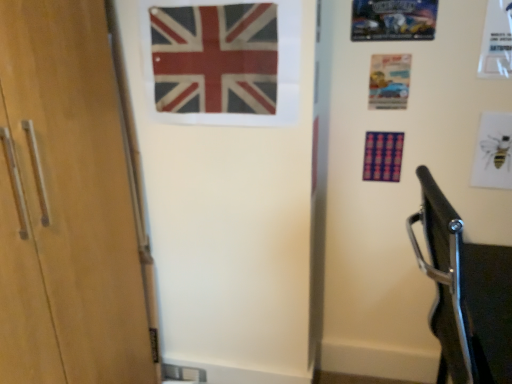
Where is `white paper bee at upper right, acting as the 3th postcard starting from the left`? This screenshot has width=512, height=384. white paper bee at upper right, acting as the 3th postcard starting from the left is located at coordinates (493, 152).

The width and height of the screenshot is (512, 384). What do you see at coordinates (389, 81) in the screenshot?
I see `matte paper postcard at upper right, acting as the second postcard starting from the top` at bounding box center [389, 81].

Find the location of `red and white fabric flag at upper center`. red and white fabric flag at upper center is located at coordinates (215, 58).

Locate an element on the screen. The height and width of the screenshot is (384, 512). white paper bee at upper right, the third postcard viewed from the top is located at coordinates (493, 152).

Is metallic silver car at upper right, the 1th postcard in the top-to-bottom sequence, taller than matte paper postcard at upper right, which ranks as the second postcard in bottom-to-top order?

No, metallic silver car at upper right, the 1th postcard in the top-to-bottom sequence, is not taller than matte paper postcard at upper right, which ranks as the second postcard in bottom-to-top order.

Is matte paper postcard at upper right, which ranks as the second postcard in bottom-to-top order, located within metallic silver car at upper right, which is counted as the third postcard, starting from the bottom?

No, metallic silver car at upper right, which is counted as the third postcard, starting from the bottom, does not contain matte paper postcard at upper right, which ranks as the second postcard in bottom-to-top order.

Considering the positions of points (401, 8) and (403, 70), is point (401, 8) farther from camera compared to point (403, 70)?

That is False.

How much distance is there between red and white fabric flag at upper center and white paper bee at upper right, positioned as the first postcard in bottom-to-top order?

red and white fabric flag at upper center is 1.00 meters from white paper bee at upper right, positioned as the first postcard in bottom-to-top order.

Is red and white fabric flag at upper center positioned with its back to white paper bee at upper right, the third postcard viewed from the top?

No, white paper bee at upper right, the third postcard viewed from the top, is not at the back of red and white fabric flag at upper center.

Based on the photo, considering the positions of objects red and white fabric flag at upper center and white paper bee at upper right, acting as the 3th postcard starting from the left, in the image provided, who is more to the right, red and white fabric flag at upper center or white paper bee at upper right, acting as the 3th postcard starting from the left,?

From the viewer's perspective, white paper bee at upper right, acting as the 3th postcard starting from the left, appears more on the right side.

Is red and white fabric flag at upper center bigger than metallic silver car at upper right, acting as the first postcard starting from the left?

Indeed, red and white fabric flag at upper center has a larger size compared to metallic silver car at upper right, acting as the first postcard starting from the left.

Between point (173, 45) and point (386, 14), which one is positioned in front?

Point (173, 45)

Is red and white fabric flag at upper center with metallic silver car at upper right, which is the 3th postcard from right to left?

There is a gap between red and white fabric flag at upper center and metallic silver car at upper right, which is the 3th postcard from right to left.

Is matte paper postcard at upper right, the 2th postcard in the left-to-right sequence, further to camera compared to metallic silver car at upper right, which is the 3th postcard from right to left?

Yes, it is.

Looking at their sizes, would you say matte paper postcard at upper right, which appears as the second postcard when viewed from the right, is wider or thinner than metallic silver car at upper right, acting as the first postcard starting from the left?

Clearly, matte paper postcard at upper right, which appears as the second postcard when viewed from the right, has less width compared to metallic silver car at upper right, acting as the first postcard starting from the left.

Is the surface of matte paper postcard at upper right, which appears as the second postcard when viewed from the right, in direct contact with metallic silver car at upper right, acting as the first postcard starting from the left?

They are not placed beside each other.

Can you confirm if matte paper postcard at upper right, acting as the second postcard starting from the top, is shorter than metallic silver car at upper right, which is counted as the third postcard, starting from the bottom?

No, matte paper postcard at upper right, acting as the second postcard starting from the top, is not shorter than metallic silver car at upper right, which is counted as the third postcard, starting from the bottom.

From the image's perspective, who appears lower, matte paper postcard at upper right, which ranks as the second postcard in bottom-to-top order, or white paper bee at upper right, positioned as the first postcard in bottom-to-top order?

white paper bee at upper right, positioned as the first postcard in bottom-to-top order, appears lower in the image.

Consider the image. Is matte paper postcard at upper right, which appears as the second postcard when viewed from the right, not within white paper bee at upper right, acting as the 3th postcard starting from the left?

matte paper postcard at upper right, which appears as the second postcard when viewed from the right, lies outside white paper bee at upper right, acting as the 3th postcard starting from the left,'s area.

How many degrees apart are the facing directions of matte paper postcard at upper right, which ranks as the second postcard in bottom-to-top order, and white paper bee at upper right, acting as the 3th postcard starting from the left?

matte paper postcard at upper right, which ranks as the second postcard in bottom-to-top order, and white paper bee at upper right, acting as the 3th postcard starting from the left, are facing 0.113 degrees away from each other.

Which object is positioned more to the left, matte paper postcard at upper right, acting as the second postcard starting from the top, or white paper bee at upper right, positioned as the first postcard in bottom-to-top order?

matte paper postcard at upper right, acting as the second postcard starting from the top, is more to the left.

Is white paper bee at upper right, positioned as the first postcard in bottom-to-top order, to the left or to the right of metallic silver car at upper right, which is counted as the third postcard, starting from the bottom, in the image?

Clearly, white paper bee at upper right, positioned as the first postcard in bottom-to-top order, is on the right of metallic silver car at upper right, which is counted as the third postcard, starting from the bottom, in the image.

Between white paper bee at upper right, the third postcard viewed from the top, and metallic silver car at upper right, which is counted as the third postcard, starting from the bottom, which one has smaller size?

metallic silver car at upper right, which is counted as the third postcard, starting from the bottom, is smaller.

Locate an element on the screen. The width and height of the screenshot is (512, 384). postcard that is in front of the white paper bee at upper right, the third postcard viewed from the top is located at coordinates (393, 20).

From the image's perspective, is white paper bee at upper right, acting as the 3th postcard starting from the left, on metallic silver car at upper right, the 1th postcard in the top-to-bottom sequence?

No, from the image's perspective, white paper bee at upper right, acting as the 3th postcard starting from the left, is not on top of metallic silver car at upper right, the 1th postcard in the top-to-bottom sequence.

Between metallic silver car at upper right, the 1th postcard in the top-to-bottom sequence, and white paper bee at upper right, the third postcard viewed from the top, which one has less height?

metallic silver car at upper right, the 1th postcard in the top-to-bottom sequence, is shorter.

Looking at their sizes, would you say metallic silver car at upper right, which is counted as the third postcard, starting from the bottom, is wider or thinner than white paper bee at upper right, acting as the 3th postcard starting from the left?

In the image, metallic silver car at upper right, which is counted as the third postcard, starting from the bottom, appears to be more narrow than white paper bee at upper right, acting as the 3th postcard starting from the left.

Measure the distance between metallic silver car at upper right, the 1th postcard in the top-to-bottom sequence, and white paper bee at upper right, the third postcard viewed from the top.

metallic silver car at upper right, the 1th postcard in the top-to-bottom sequence, and white paper bee at upper right, the third postcard viewed from the top, are 19.93 inches apart.

Where is `the 1st postcard to the right of the metallic silver car at upper right, which is the 3th postcard from right to left, starting your count from the anchor`? Image resolution: width=512 pixels, height=384 pixels. the 1st postcard to the right of the metallic silver car at upper right, which is the 3th postcard from right to left, starting your count from the anchor is located at coordinates (389, 81).

Locate an element on the screen. flag on the left of the white paper bee at upper right, placed as the 1th postcard when sorted from right to left is located at coordinates (215, 58).

Which object lies nearer to the anchor point metallic silver car at upper right, which is the 3th postcard from right to left, white paper bee at upper right, placed as the 1th postcard when sorted from right to left, or red and white fabric flag at upper center?

Among the two, white paper bee at upper right, placed as the 1th postcard when sorted from right to left, is located nearer to metallic silver car at upper right, which is the 3th postcard from right to left.

Looking at the image, which one is located further to matte paper postcard at upper right, which ranks as the second postcard in bottom-to-top order, metallic silver car at upper right, which is the 3th postcard from right to left, or white paper bee at upper right, the third postcard viewed from the top?

Based on the image, white paper bee at upper right, the third postcard viewed from the top, appears to be further to matte paper postcard at upper right, which ranks as the second postcard in bottom-to-top order.

When comparing their distances from white paper bee at upper right, acting as the 3th postcard starting from the left, does metallic silver car at upper right, which is counted as the third postcard, starting from the bottom, or red and white fabric flag at upper center seem further?

The object further to white paper bee at upper right, acting as the 3th postcard starting from the left, is red and white fabric flag at upper center.

When comparing their distances from matte paper postcard at upper right, acting as the second postcard starting from the top, does metallic silver car at upper right, which is the 3th postcard from right to left, or red and white fabric flag at upper center seem closer?

Among the two, metallic silver car at upper right, which is the 3th postcard from right to left, is located nearer to matte paper postcard at upper right, acting as the second postcard starting from the top.

Looking at this image, looking at the image, which one is located further to matte paper postcard at upper right, which ranks as the second postcard in bottom-to-top order, white paper bee at upper right, positioned as the first postcard in bottom-to-top order, or red and white fabric flag at upper center?

red and white fabric flag at upper center is positioned further to the anchor matte paper postcard at upper right, which ranks as the second postcard in bottom-to-top order.

Looking at the image, which one is located further to matte paper postcard at upper right, which appears as the second postcard when viewed from the right, red and white fabric flag at upper center or white paper bee at upper right, acting as the 3th postcard starting from the left?

red and white fabric flag at upper center is further to matte paper postcard at upper right, which appears as the second postcard when viewed from the right.

From the image, which object appears to be farther from matte paper postcard at upper right, which appears as the second postcard when viewed from the right, white paper bee at upper right, placed as the 1th postcard when sorted from right to left, or metallic silver car at upper right, which is counted as the third postcard, starting from the bottom?

white paper bee at upper right, placed as the 1th postcard when sorted from right to left, is further to matte paper postcard at upper right, which appears as the second postcard when viewed from the right.

When comparing their distances from white paper bee at upper right, placed as the 1th postcard when sorted from right to left, does red and white fabric flag at upper center or matte paper postcard at upper right, acting as the second postcard starting from the top, seem closer?

Based on the image, matte paper postcard at upper right, acting as the second postcard starting from the top, appears to be nearer to white paper bee at upper right, placed as the 1th postcard when sorted from right to left.

Find the location of a particular element. The image size is (512, 384). postcard between red and white fabric flag at upper center and matte paper postcard at upper right, acting as the second postcard starting from the top, in the horizontal direction is located at coordinates (393, 20).

Where is `postcard located between metallic silver car at upper right, which is counted as the third postcard, starting from the bottom, and white paper bee at upper right, placed as the 1th postcard when sorted from right to left, in the left-right direction`? postcard located between metallic silver car at upper right, which is counted as the third postcard, starting from the bottom, and white paper bee at upper right, placed as the 1th postcard when sorted from right to left, in the left-right direction is located at coordinates (389, 81).